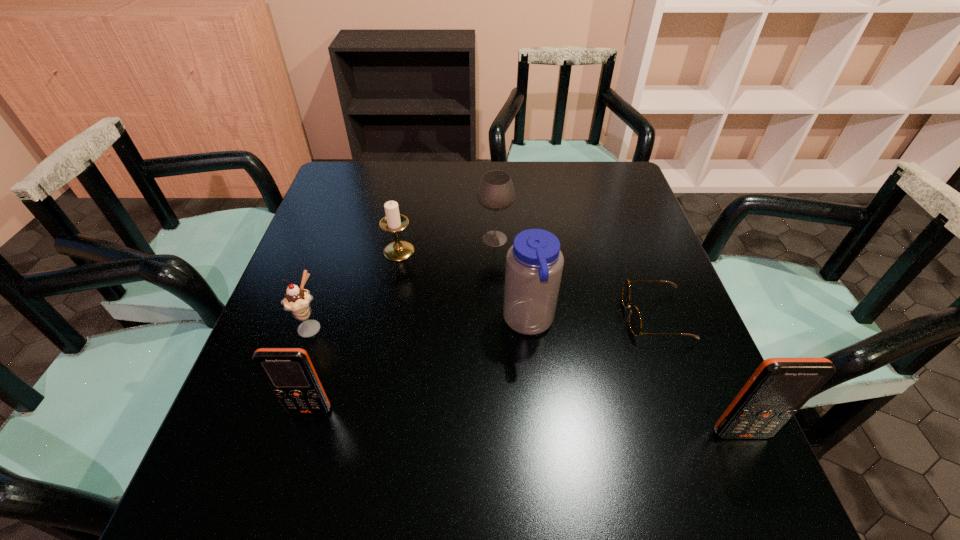
Where is `cellular telephone situated at the right edge`? This screenshot has height=540, width=960. cellular telephone situated at the right edge is located at coordinates (779, 387).

The height and width of the screenshot is (540, 960). I want to click on sunglasses located in the right edge section of the desktop, so click(635, 322).

Locate an element on the screen. This screenshot has width=960, height=540. object that is positioned at the near left corner is located at coordinates (289, 373).

Locate an element on the screen. object that is positioned at the near right corner is located at coordinates (779, 387).

The image size is (960, 540). In the image, there is a desktop. Find the location of `vacant space at the far edge`. vacant space at the far edge is located at coordinates (542, 197).

What are the coordinates of `free space at the near edge of the desktop` in the screenshot? It's located at (596, 408).

At what (x,y) coordinates should I click in order to perform the action: click on free space at the left edge. Please return your answer as a coordinate pair (x, y). The image size is (960, 540). Looking at the image, I should click on (306, 339).

I want to click on vacant region at the right edge, so click(592, 215).

Image resolution: width=960 pixels, height=540 pixels. In the image, there is a desktop. Find the location of `vacant space at the near left corner`. vacant space at the near left corner is located at coordinates (293, 448).

Identify the location of vacant space at the far right corner of the desktop. This screenshot has height=540, width=960. click(623, 172).